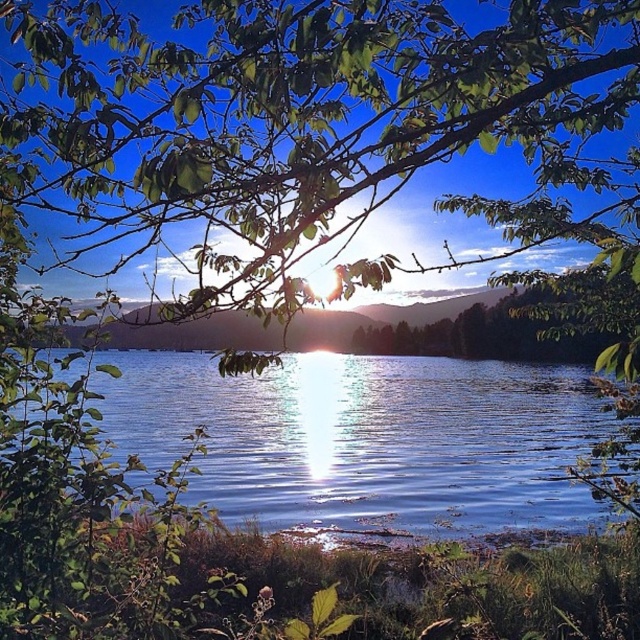
Who is more distant from viewer, (291,246) or (230,381)?

The point (230,381) is more distant.

Can you confirm if green leafy branches at upper center is wider than glistening blue water at center?

Correct, the width of green leafy branches at upper center exceeds that of glistening blue water at center.

Find the location of a particular element. The width and height of the screenshot is (640, 640). green leafy branches at upper center is located at coordinates (308, 125).